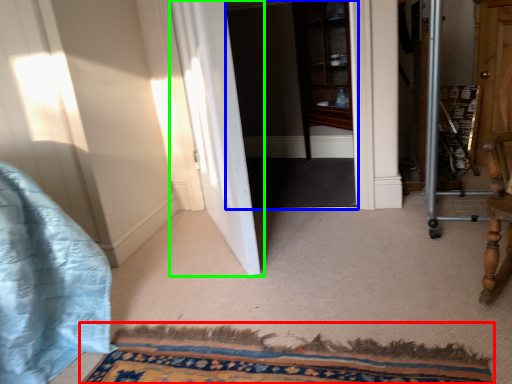
Question: Which is farther away from doormat (highlighted by a red box)? screen door (highlighted by a blue box) or door (highlighted by a green box)?

Choices:
 (A) screen door
 (B) door

Answer: (A)